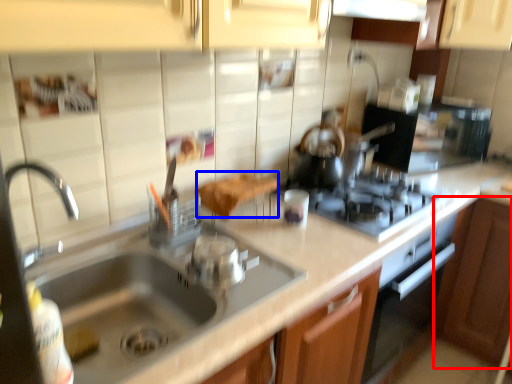
Question: Which point is further to the camera, cabinetry (highlighted by a red box) or food (highlighted by a blue box)?

Choices:
 (A) cabinetry
 (B) food

Answer: (A)